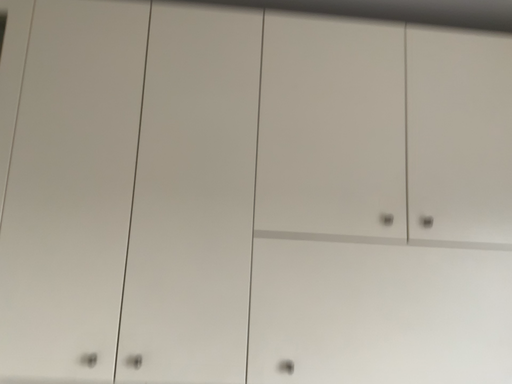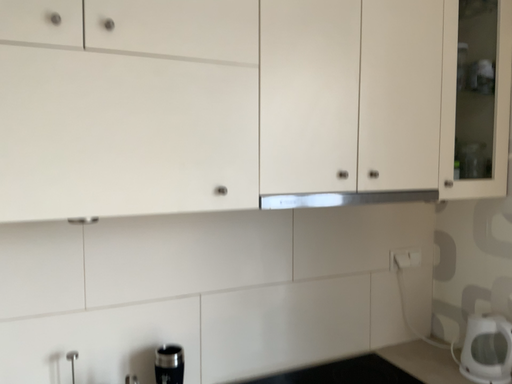
Question: How did the camera likely rotate when shooting the video?

Choices:
 (A) rotated right
 (B) rotated left

Answer: (A)